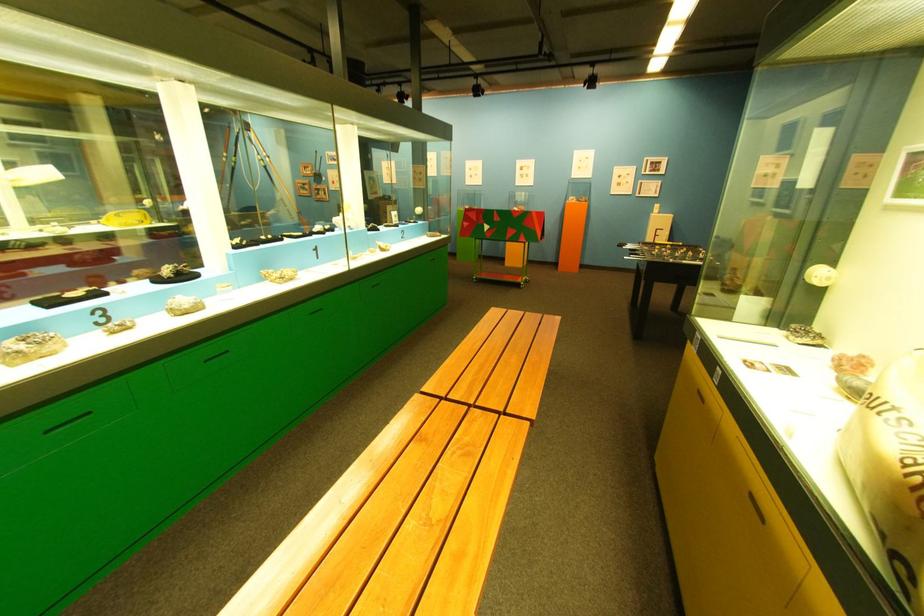
Find the location of `white round switch`. white round switch is located at coordinates (821, 275).